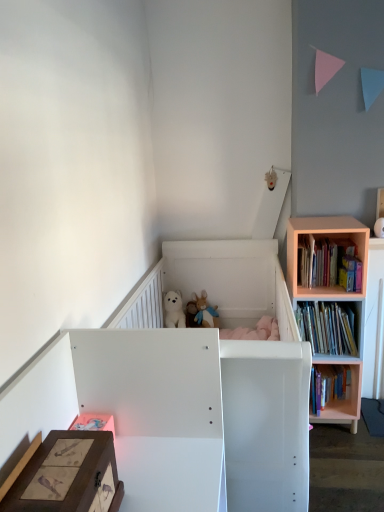
Question: Does wooden bookshelf at right, positioned as the 3th book in bottom-to-top order, have a greater width compared to white matte infant bed at center?

Choices:
 (A) yes
 (B) no

Answer: (B)

Question: Does wooden bookshelf at right, the 1th book from the top, appear on the left side of white matte infant bed at center?

Choices:
 (A) yes
 (B) no

Answer: (B)

Question: Can you confirm if wooden bookshelf at right, the 1th book from the top, is smaller than white matte infant bed at center?

Choices:
 (A) no
 (B) yes

Answer: (B)

Question: Is wooden bookshelf at right, the 1th book from the top, next to white matte infant bed at center?

Choices:
 (A) yes
 (B) no

Answer: (B)

Question: Is wooden bookshelf at right, positioned as the 3th book in bottom-to-top order, to the right of white matte infant bed at center from the viewer's perspective?

Choices:
 (A) no
 (B) yes

Answer: (B)

Question: Considering the relative positions of wooden bookshelf at right, the 1th book from the top, and white matte infant bed at center in the image provided, is wooden bookshelf at right, the 1th book from the top, behind white matte infant bed at center?

Choices:
 (A) yes
 (B) no

Answer: (A)

Question: Is fluffy plush toys at center, which is counted as the 2th toy, starting from the top, facing towards wooden bookshelf at right, the 1th book from the top?

Choices:
 (A) no
 (B) yes

Answer: (A)

Question: Does fluffy plush toys at center, acting as the second toy starting from the right, contain wooden bookshelf at right, positioned as the 3th book in bottom-to-top order?

Choices:
 (A) yes
 (B) no

Answer: (B)

Question: From a real-world perspective, is fluffy plush toys at center, acting as the second toy starting from the right, on wooden bookshelf at right, positioned as the 3th book in bottom-to-top order?

Choices:
 (A) no
 (B) yes

Answer: (A)

Question: Does fluffy plush toys at center, the first toy when ordered from left to right, have a greater width compared to wooden bookshelf at right, the 1th book from the top?

Choices:
 (A) yes
 (B) no

Answer: (B)

Question: Is fluffy plush toys at center, the second toy in the front-to-back sequence, far from wooden bookshelf at right, the 1th book from the top?

Choices:
 (A) no
 (B) yes

Answer: (A)

Question: Is fluffy plush toys at center, acting as the first toy starting from the bottom, further to the viewer compared to wooden bookshelf at right, the 1th book from the top?

Choices:
 (A) no
 (B) yes

Answer: (B)

Question: Is hardcover book at right, the 1th book from the bottom, completely or partially inside matte white vase at upper right, which is the 1th toy from right to left?

Choices:
 (A) yes
 (B) no

Answer: (B)